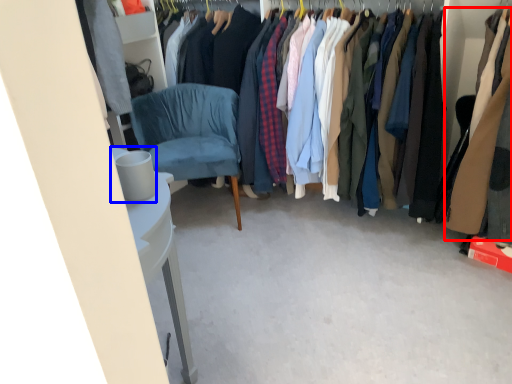
Question: Which object is further to the camera taking this photo, clothing (highlighted by a red box) or trash bin/can (highlighted by a blue box)?

Choices:
 (A) clothing
 (B) trash bin/can

Answer: (A)